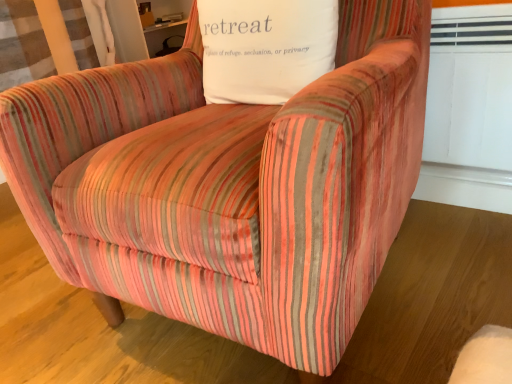
Question: Should I look upward or downward to see white cotton pillow at upper center?

Choices:
 (A) up
 (B) down

Answer: (A)